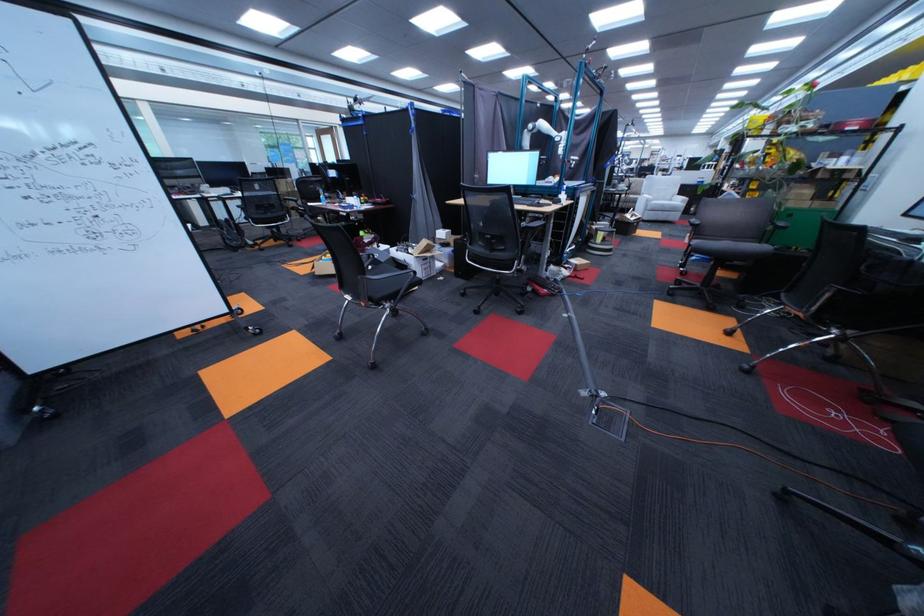
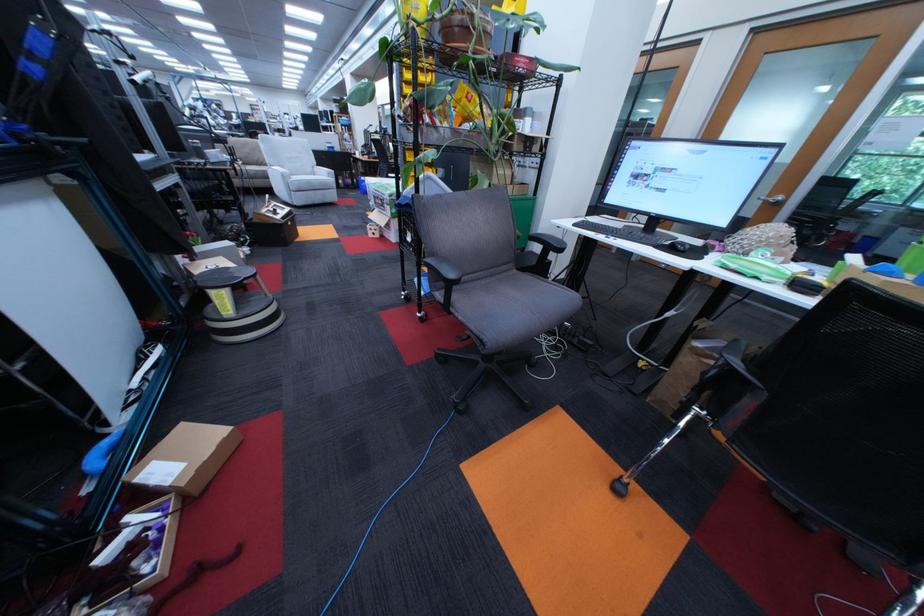
Where in the second image is the point corresponding to (613,233) from the first image?

(225, 294)